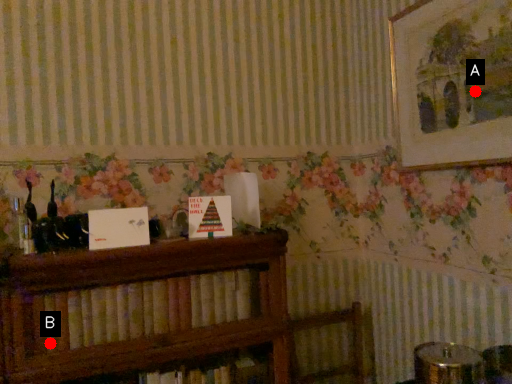
Question: Two points are circled on the image, labeled by A and B beside each circle. Which point appears closest to the camera in this image?

Choices:
 (A) A is closer
 (B) B is closer

Answer: (B)